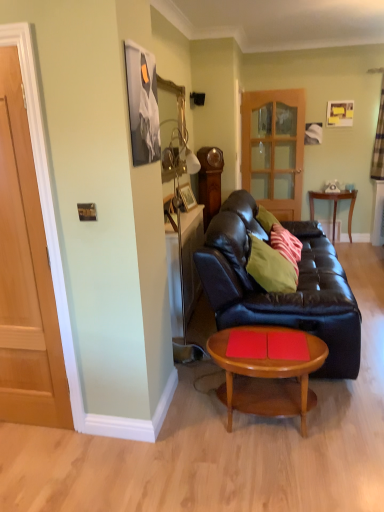
At what (x,y) coordinates should I click in order to perform the action: click on vacant area in front of wooden door at left. Please return your answer as a coordinate pair (x, y). Looking at the image, I should click on (28, 456).